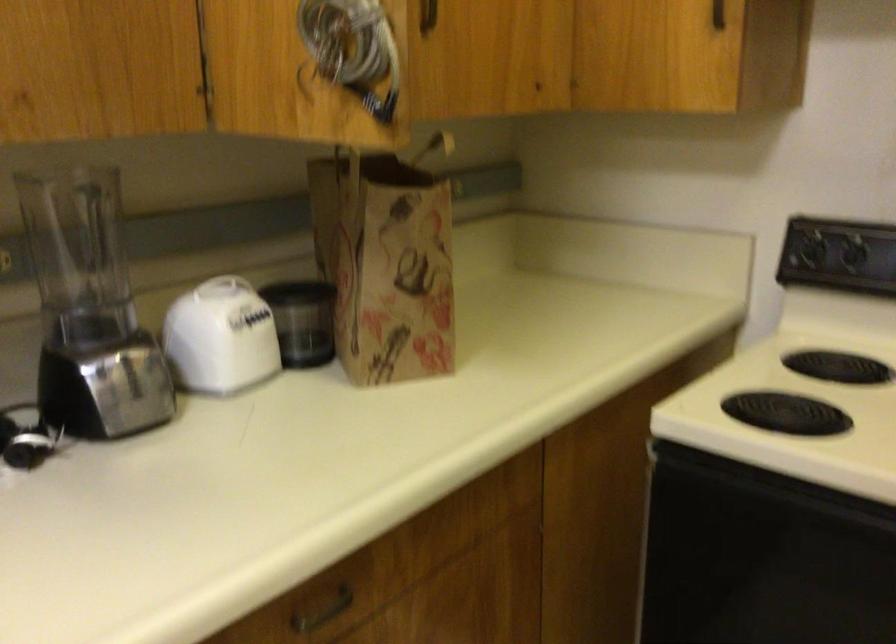
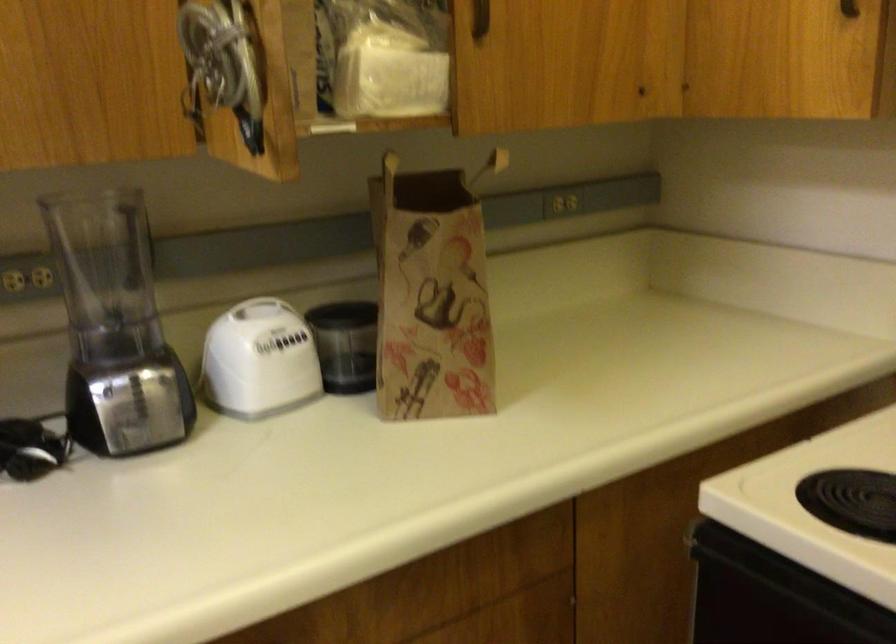
Where in the second image is the point corresponding to the point at 412,265 from the first image?

(431, 295)